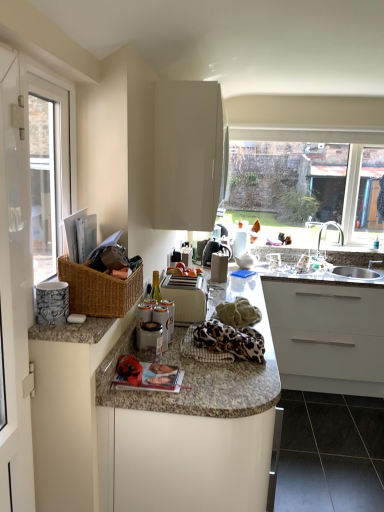
The width and height of the screenshot is (384, 512). I want to click on blank space situated above black glossy tile at lower right (from a real-world perspective), so click(x=341, y=433).